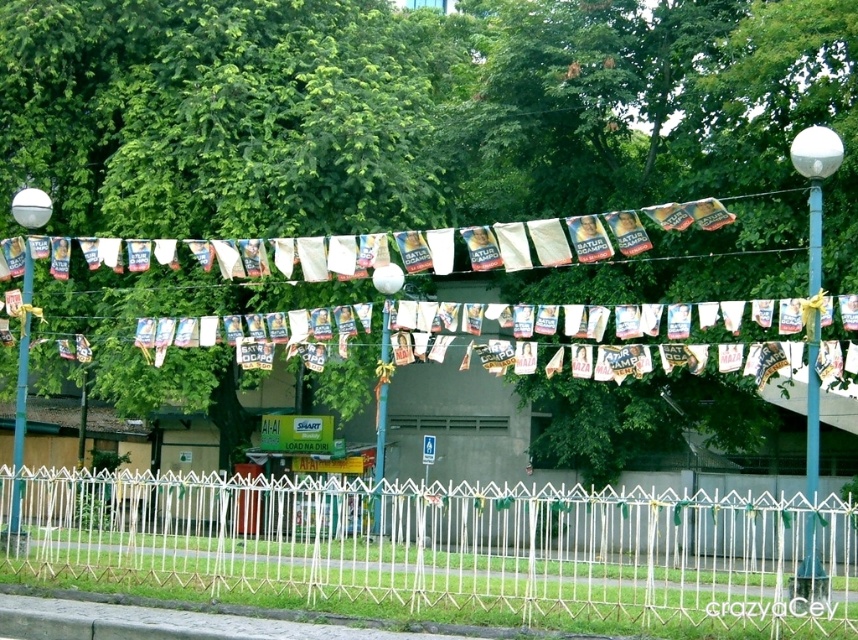
In the scene shown: Who is positioned more to the left, blue metallic pole at right or metallic pole at left?

metallic pole at left is more to the left.

At what (x,y) coordinates should I click in order to perform the action: click on blue metallic pole at right. Please return your answer as a coordinate pair (x, y). The width and height of the screenshot is (858, 640). Looking at the image, I should click on (813, 406).

Describe the element at coordinates (813, 406) in the screenshot. I see `blue metallic pole at right` at that location.

The image size is (858, 640). What are the coordinates of `blue metallic pole at right` in the screenshot? It's located at (813, 406).

Can you confirm if white bamboo fence at lower center is taller than metallic pole at left?

Yes, white bamboo fence at lower center is taller than metallic pole at left.

Is point (699, 499) more distant than point (26, 269)?

No, (699, 499) is closer to viewer.

The image size is (858, 640). Identify the location of white bamboo fence at lower center. (449, 545).

The image size is (858, 640). Find the location of `white bamboo fence at lower center`. white bamboo fence at lower center is located at coordinates (449, 545).

How far apart are metallic pole at left and blue metallic pole at center?

metallic pole at left is 5.01 meters away from blue metallic pole at center.

Does metallic pole at left have a lesser height compared to blue metallic pole at center?

Indeed, metallic pole at left has a lesser height compared to blue metallic pole at center.

This screenshot has width=858, height=640. In order to click on metallic pole at left in this screenshot , I will do `click(17, 449)`.

The height and width of the screenshot is (640, 858). Find the location of `metallic pole at left`. metallic pole at left is located at coordinates point(17,449).